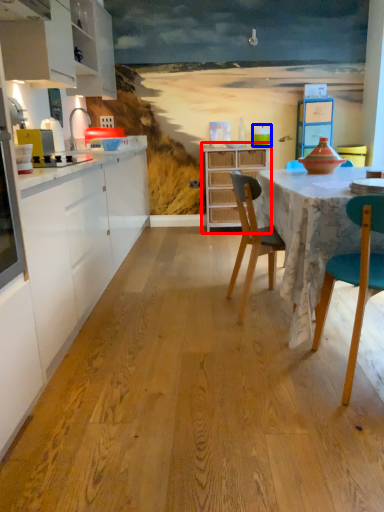
Question: Which of the following is the farthest to the observer, cupboard (highlighted by a red box) or teal (highlighted by a blue box)?

Choices:
 (A) cupboard
 (B) teal

Answer: (B)